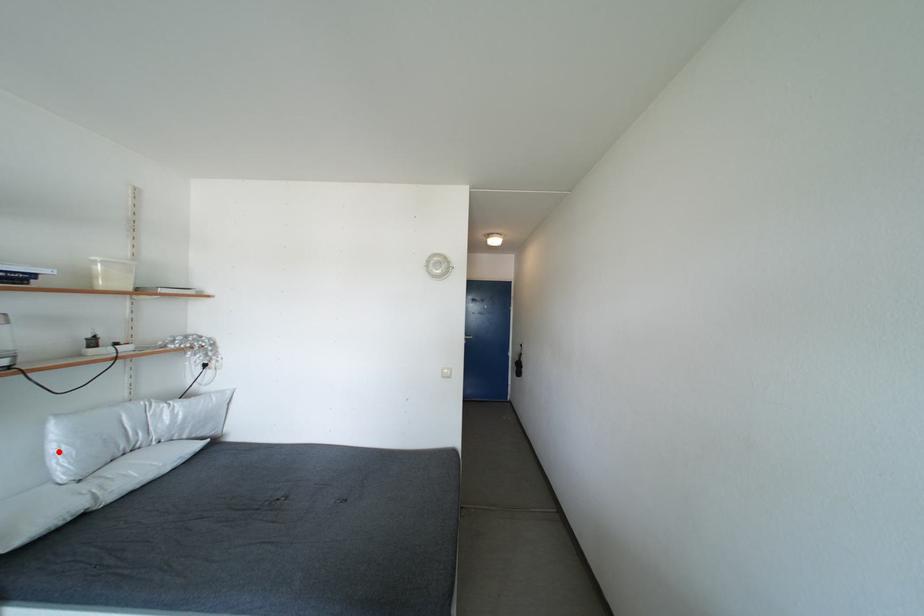
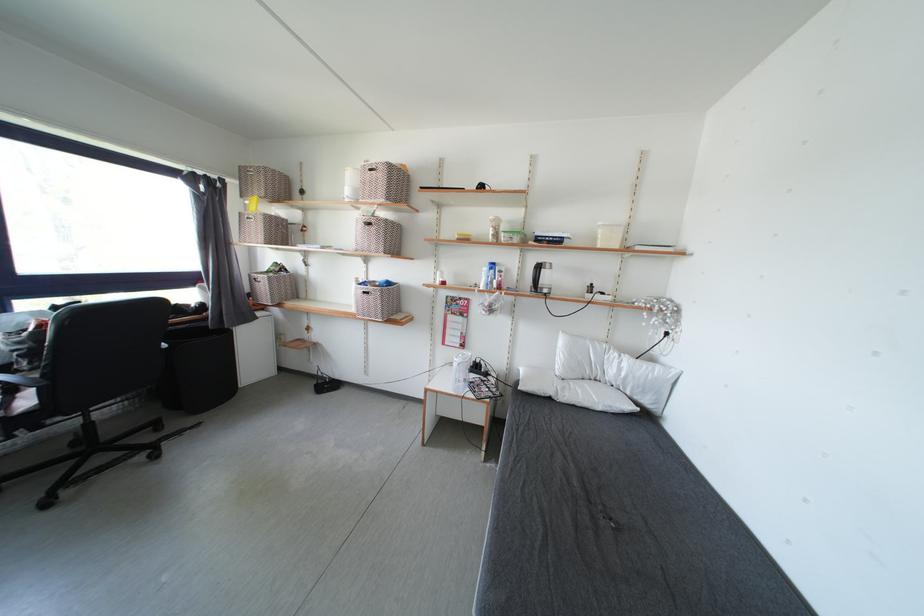
In the second image, find the point that corresponds to the highlighted location in the first image.

(565, 355)